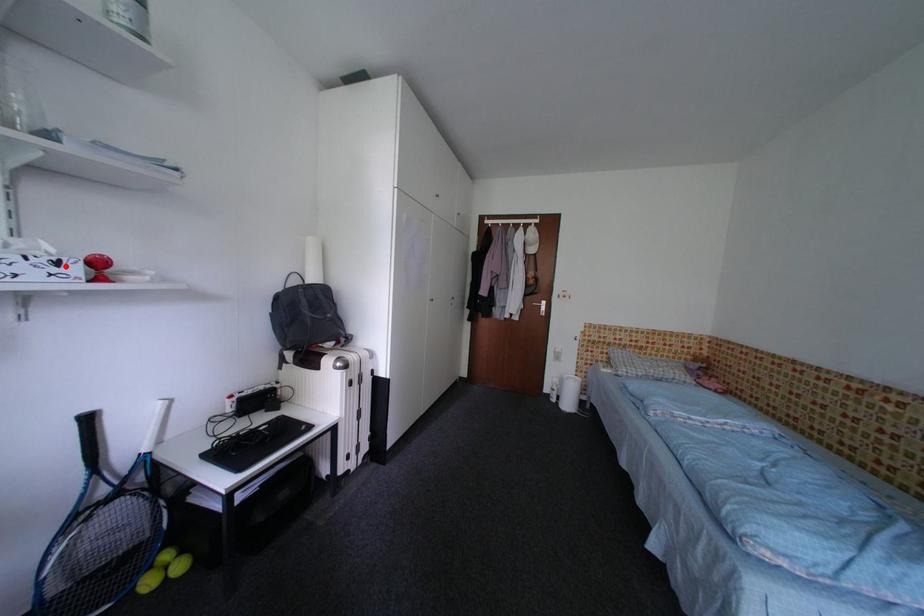
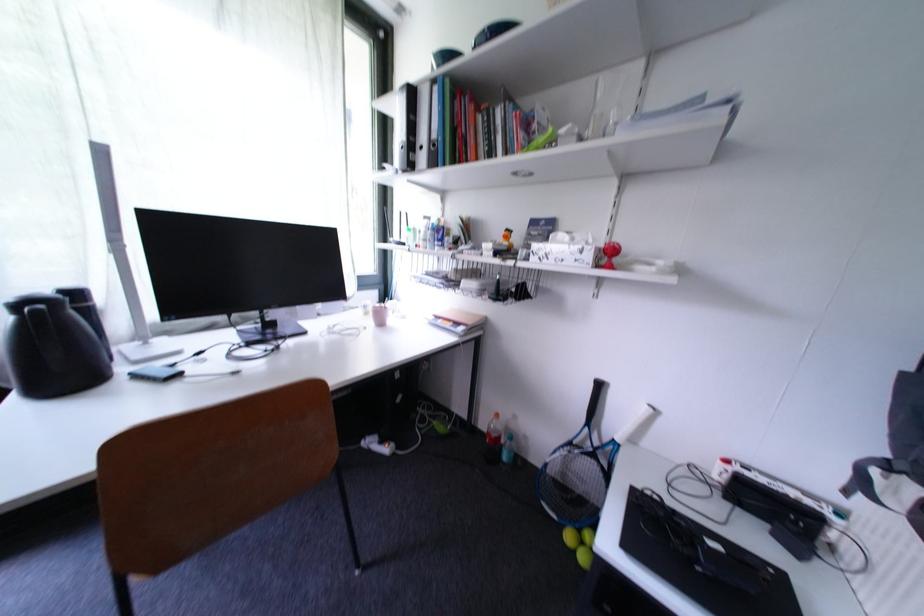
In the second image, find the point that corresponds to the highlighted location in the first image.

(590, 253)